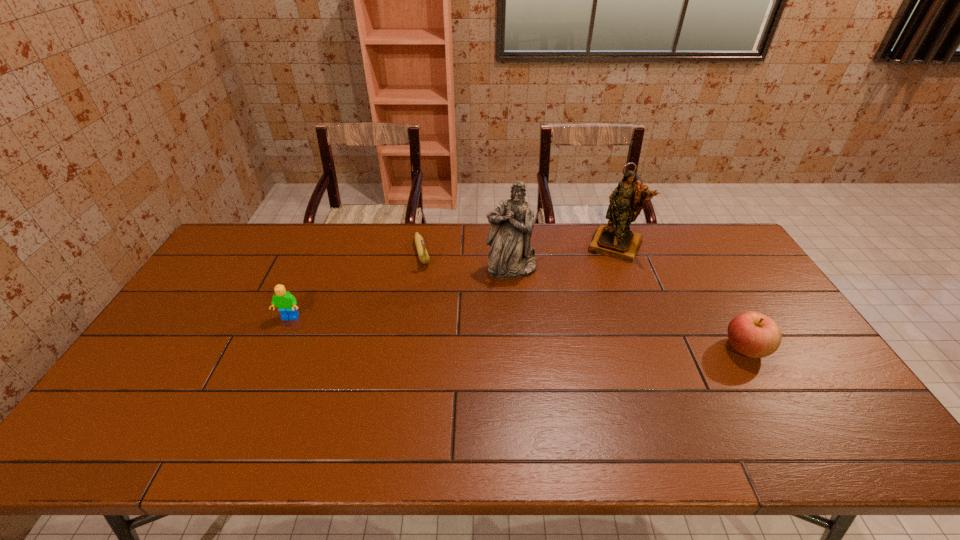
Identify the location of the leftmost object. The height and width of the screenshot is (540, 960). (284, 300).

Image resolution: width=960 pixels, height=540 pixels. Identify the location of the fourth farthest object. (284, 300).

Locate an element on the screen. The height and width of the screenshot is (540, 960). the nearest object is located at coordinates (753, 334).

Locate an element on the screen. The image size is (960, 540). the rightmost object is located at coordinates (753, 334).

Locate an element on the screen. This screenshot has width=960, height=540. the right figurine is located at coordinates [616, 240].

This screenshot has height=540, width=960. I want to click on the third object from right to left, so click(511, 255).

Identify the location of banana. (424, 258).

Find the location of a particular element. The height and width of the screenshot is (540, 960). vacant point located 0.110m on the face of the Lego is located at coordinates (275, 353).

Where is `vacant area located on the left of the nearest object`? This screenshot has height=540, width=960. vacant area located on the left of the nearest object is located at coordinates (697, 348).

What are the coordinates of `free space located 0.310m on the front-facing side of the second object from right to left` in the screenshot? It's located at (580, 319).